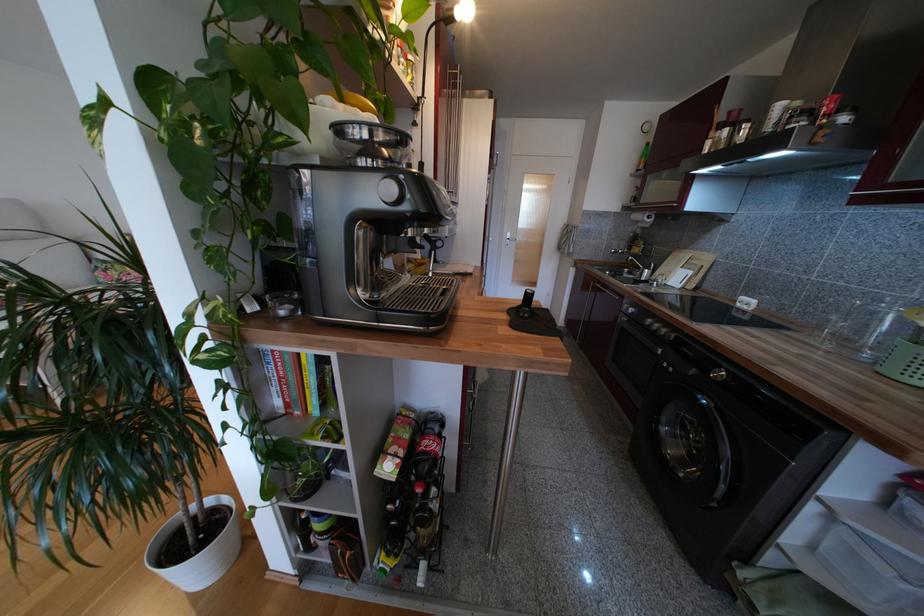
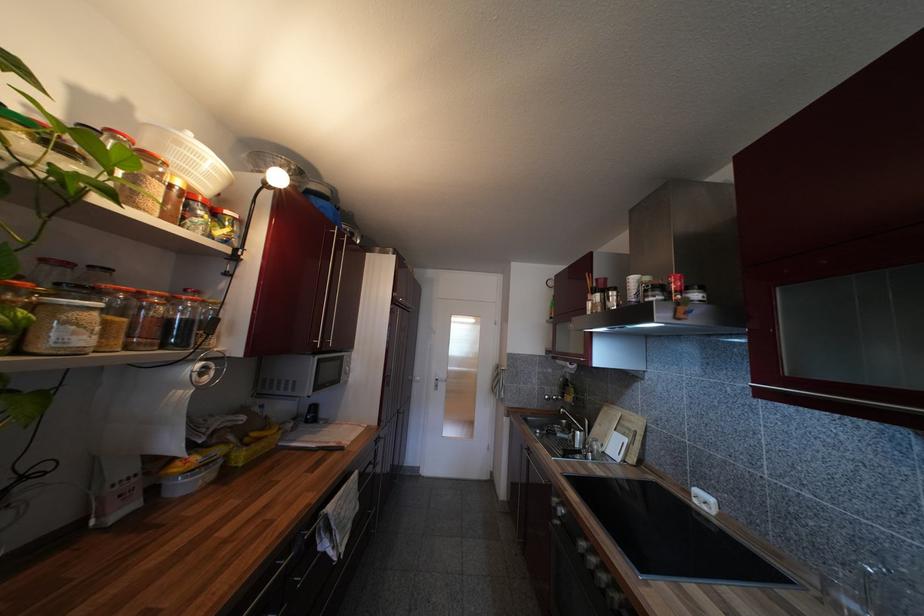
What movement of the cameraman would produce the second image?

The cameraman walked toward right, forward.